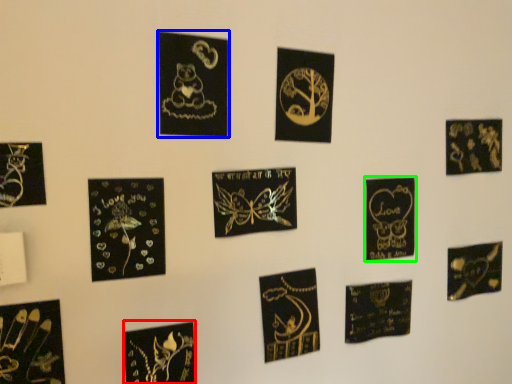
Question: Based on their relative distances, which object is farther from picture frame (highlighted by a red box)? Choose from picture frame (highlighted by a blue box) and picture frame (highlighted by a green box).

Choices:
 (A) picture frame
 (B) picture frame

Answer: (B)